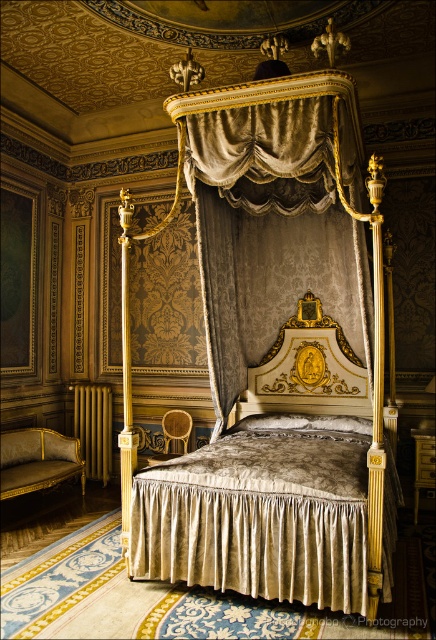
Question: Which point is closer to the camera taking this photo?

Choices:
 (A) (320, 305)
 (B) (224, 259)

Answer: (B)

Question: Which of these objects is positioned farthest from the velvet/golden bedskirt at center?

Choices:
 (A) velvet/golden drapery at center
 (B) gold velvet headboard at center

Answer: (A)

Question: From the image, what is the correct spatial relationship of velvet/golden drapery at center in relation to gold velvet headboard at center?

Choices:
 (A) left
 (B) right

Answer: (A)

Question: Is velvet/golden bedskirt at center above velvet/golden drapery at center?

Choices:
 (A) yes
 (B) no

Answer: (B)

Question: Which point appears closest to the camera in this image?

Choices:
 (A) (360, 298)
 (B) (231, 410)

Answer: (A)

Question: Does velvet/golden bedskirt at center have a larger size compared to gold velvet headboard at center?

Choices:
 (A) yes
 (B) no

Answer: (A)